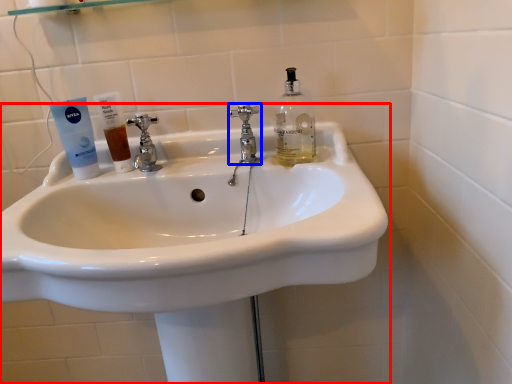
Question: Which object is further to the camera taking this photo, sink (highlighted by a red box) or tap (highlighted by a blue box)?

Choices:
 (A) sink
 (B) tap

Answer: (B)